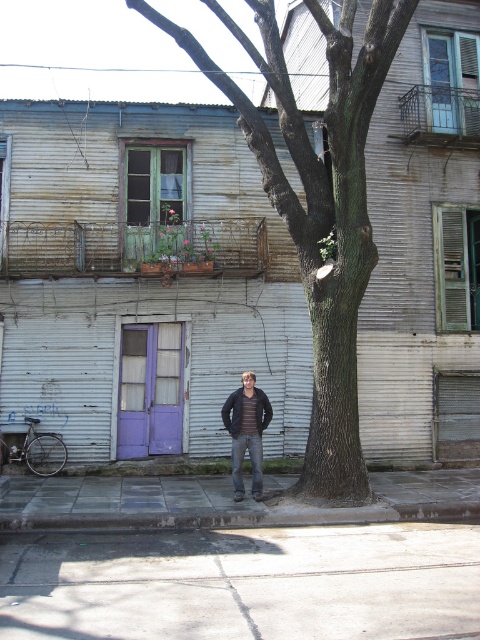
Question: Considering the relative positions of smooth bark tree at center and gray concrete curb at lower center in the image provided, where is smooth bark tree at center located with respect to gray concrete curb at lower center?

Choices:
 (A) below
 (B) above

Answer: (B)

Question: Is smooth bark tree at center bigger than dark gray jacket at center?

Choices:
 (A) no
 (B) yes

Answer: (B)

Question: Estimate the real-world distances between objects in this image. Which object is closer to the dark gray jacket at center?

Choices:
 (A) gray concrete curb at lower center
 (B) smooth bark tree at center

Answer: (A)

Question: Where is smooth bark tree at center located in relation to dark gray jacket at center in the image?

Choices:
 (A) left
 (B) right

Answer: (A)

Question: Which of the following is the closest to the observer?

Choices:
 (A) smooth bark tree at center
 (B) dark gray jacket at center

Answer: (A)

Question: Estimate the real-world distances between objects in this image. Which object is farther from the smooth bark tree at center?

Choices:
 (A) dark gray jacket at center
 (B) gray concrete curb at lower center

Answer: (B)